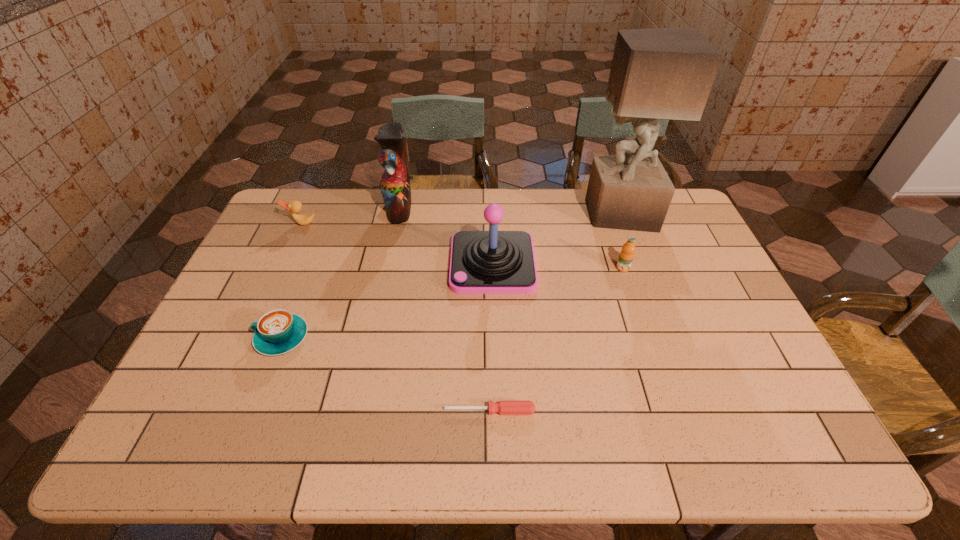
What are the coordinates of `vacant region located with the handle on the right side of the second shortest object` in the screenshot? It's located at (204, 338).

I want to click on vacant space located on the right of the screwdriver, so click(x=624, y=411).

I want to click on sculpture at the far edge, so click(x=662, y=73).

The width and height of the screenshot is (960, 540). In order to click on parrot that is at the far edge in this screenshot , I will do `click(395, 184)`.

At what (x,y) coordinates should I click in order to perform the action: click on duck present at the far edge. Please return your answer as a coordinate pair (x, y). This screenshot has width=960, height=540. Looking at the image, I should click on (295, 206).

The height and width of the screenshot is (540, 960). What are the coordinates of `duck that is at the left edge` in the screenshot? It's located at (295, 206).

You are a GUI agent. You are given a task and a screenshot of the screen. Output one action in this format:
    pyautogui.click(x=<x>, y=<y>)
    Task: Click on the cappuccino present at the left edge
    The image size is (960, 540).
    Given the screenshot: What is the action you would take?
    pyautogui.click(x=277, y=332)

Find the location of a particular element. The width and height of the screenshot is (960, 540). object that is positioned at the right edge is located at coordinates (662, 73).

This screenshot has height=540, width=960. I want to click on object positioned at the far left corner, so click(x=295, y=206).

The width and height of the screenshot is (960, 540). In order to click on object present at the far right corner in this screenshot , I will do `click(662, 73)`.